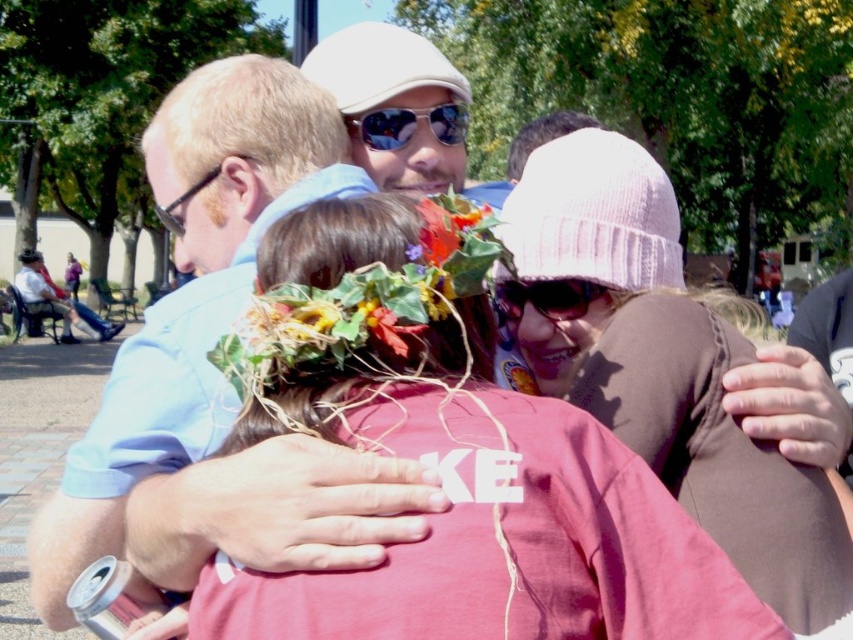
Question: Which point is farther to the camera?

Choices:
 (A) (625, 228)
 (B) (407, 129)
 (C) (372, 310)

Answer: (B)

Question: Is light blue shirt at left further to camera compared to black plastic goggles at left?

Choices:
 (A) no
 (B) yes

Answer: (B)

Question: Which point is farther from the camera taking this photo?

Choices:
 (A) (26, 269)
 (B) (274, 212)
 (C) (531, 618)

Answer: (A)

Question: Observing the image, what is the correct spatial positioning of pink knit hat at center in reference to floral crown at center?

Choices:
 (A) left
 (B) right

Answer: (B)

Question: Which point is closer to the camera taking this photo?

Choices:
 (A) (99, 330)
 (B) (456, 115)
 (C) (595, 298)
 (D) (386, 280)

Answer: (D)

Question: Is pink knit hat at center in front of pink knit hat at upper right?

Choices:
 (A) yes
 (B) no

Answer: (A)